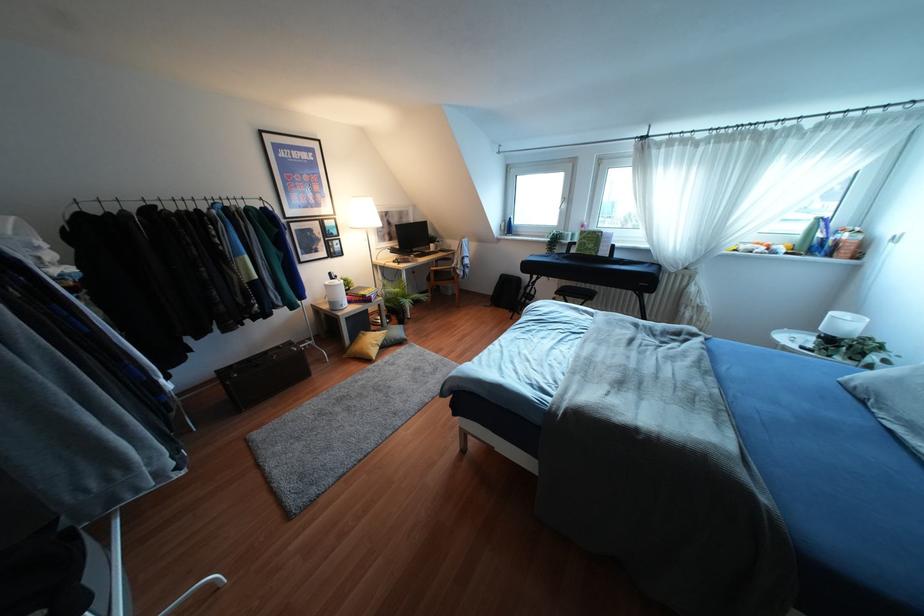
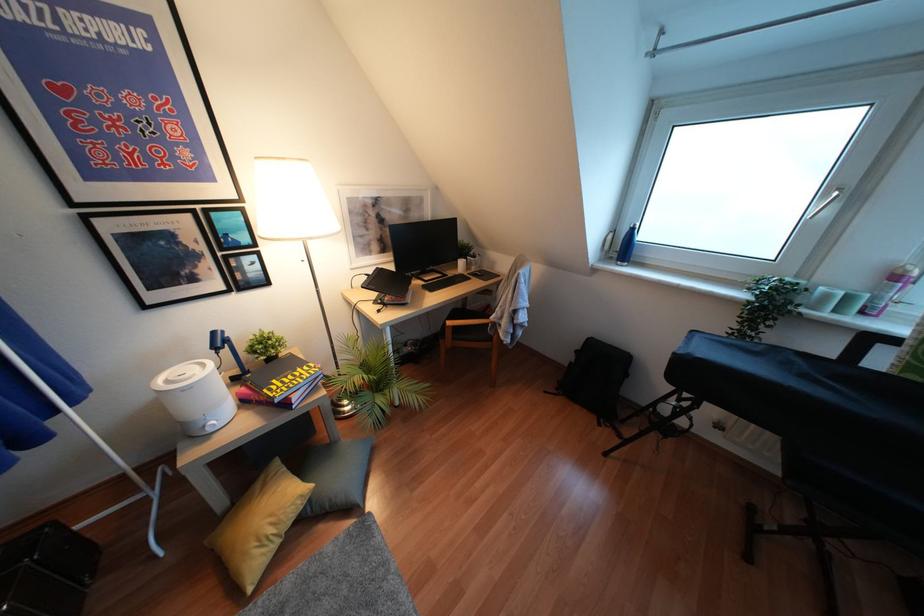
The point at [572,235] is marked in the first image. Where is the corresponding point in the second image?

(846, 298)